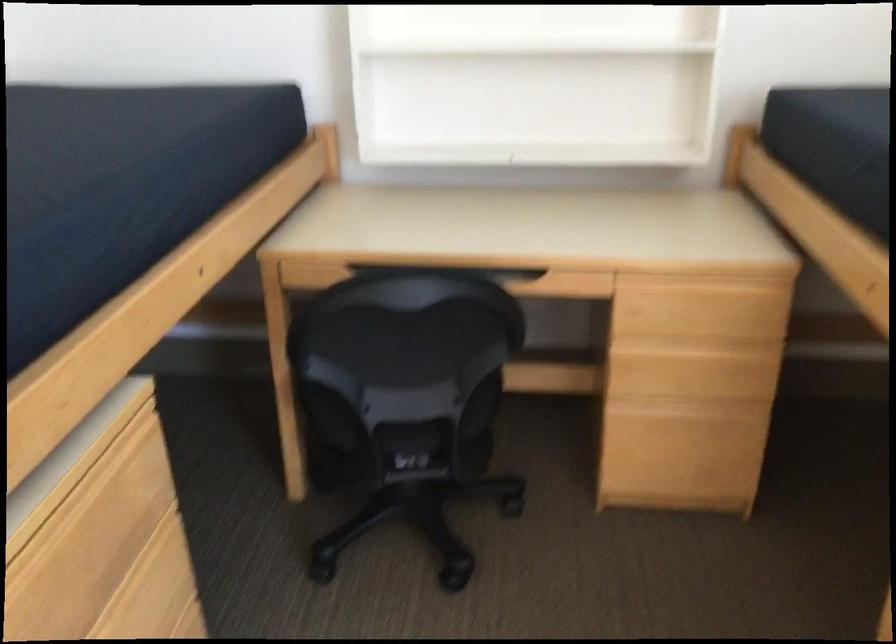
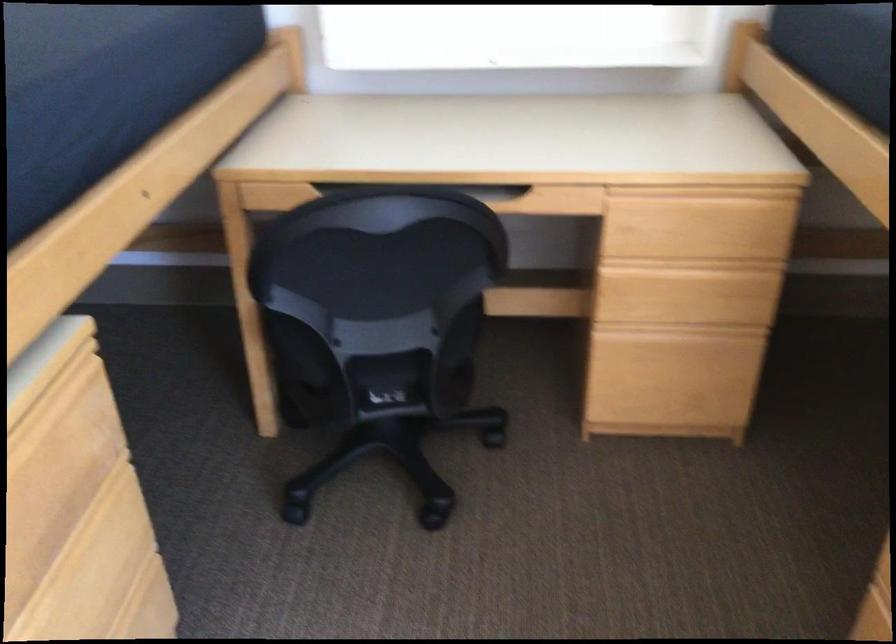
Question: The images are taken continuously from a first-person perspective. In which direction are you moving?

Choices:
 (A) Left
 (B) Right
 (C) Forward
 (D) Backward

Answer: (C)